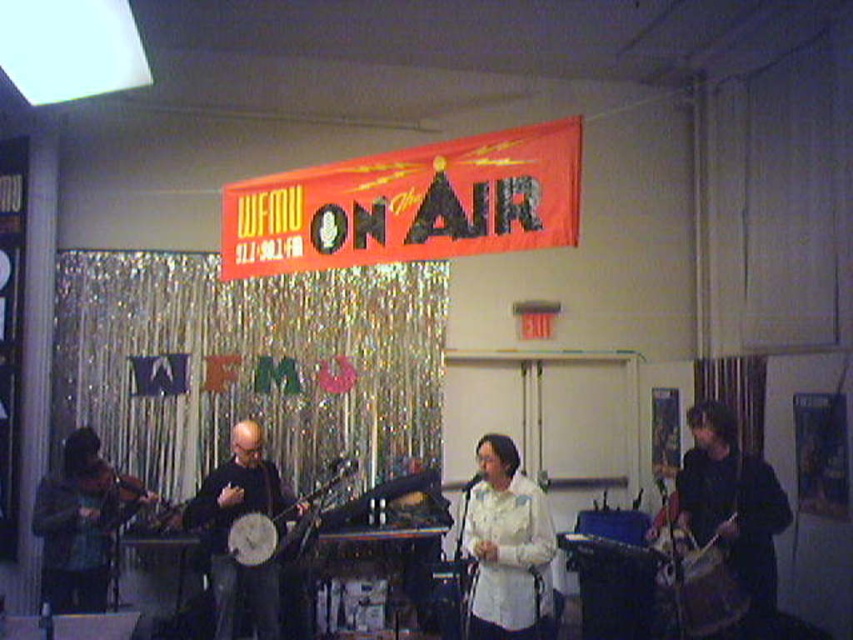
You are a stagehand setting up for a live performance. You need to place a microphone stand between the black matte banjo at center and the wooden banjo at center. Which banjo should the microphone stand be placed closer to if the stand is only 1.2 meters tall?

The microphone stand should be placed closer to the wooden banjo at center because the black matte banjo at center is much taller and may block the microphone if placed too close.

You are a stagehand setting up equipment for the performance. You need to ensure that the matte black banjo at center and the white textured shirt at center are visible to the audience. Considering their heights, which object might require adjustment to ensure visibility?

The matte black banjo at center is taller than the white textured shirt at center. Since the banjo is already taller, it might block the shirt from view. To ensure visibility, the stagehand could lower the banjo or raise the white textured shirt.